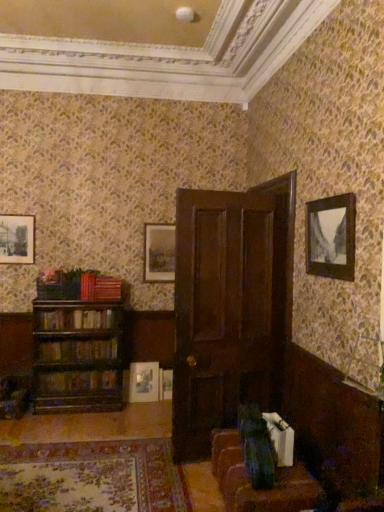
Question: From the image's perspective, is wooden book at left, which is the fourth book from top to bottom, above or below dark wood door at center?

Choices:
 (A) above
 (B) below

Answer: (B)

Question: Is point (102, 381) positioned closer to the camera than point (200, 375)?

Choices:
 (A) farther
 (B) closer

Answer: (A)

Question: Estimate the real-world distances between objects in this image. Which object is closer to the wooden bookshelf at left, positioned as the third book in bottom-to-top order?

Choices:
 (A) matte silver picture frame at center, which appears as the first picture frame when ordered from the bottom
 (B) wooden bookshelf at left, which is counted as the 2th book, starting from the bottom
 (C) matte wooden picture frame at center, the 3th picture frame in the left-to-right sequence
 (D) wooden picture frame at upper right, which is the 2th picture frame from top to bottom
 (E) matte black picture frame at upper left, marked as the second picture frame in a front-to-back arrangement

Answer: (B)

Question: Estimate the real-world distances between objects in this image. Which object is farther from the matte silver picture frame at center, which appears as the first picture frame when ordered from the bottom?

Choices:
 (A) wooden picture frame at upper right, which is the 1th picture frame from front to back
 (B) velvet brown couch at lower right
 (C) wooden bookshelf at left, which is counted as the 2th book, starting from the bottom
 (D) wooden bookshelf at left, the 2th book viewed from the top
 (E) velvet green swivel chair at lower center

Answer: (A)